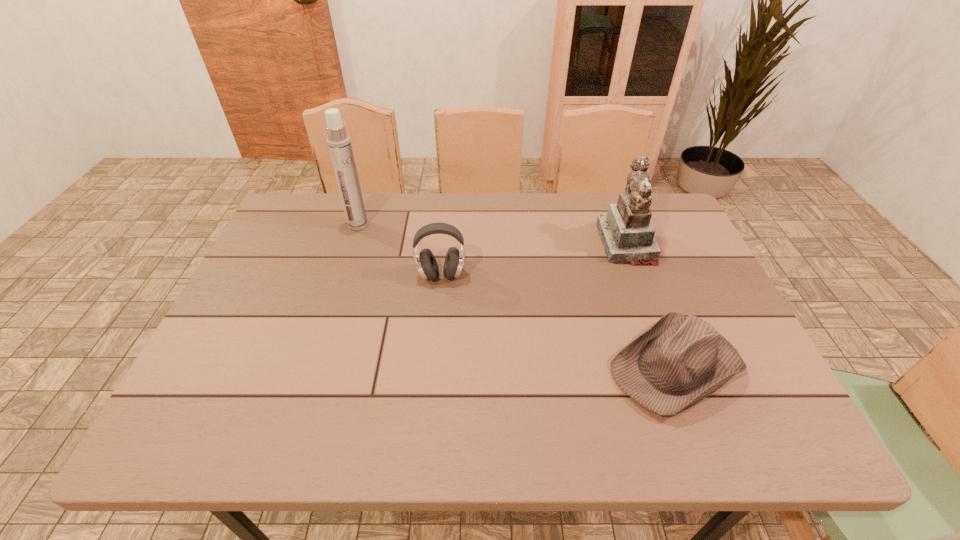
Image resolution: width=960 pixels, height=540 pixels. I want to click on free space at the far edge of the desktop, so pos(582,203).

In the image, there is a desktop. At what (x,y) coordinates should I click in order to perform the action: click on free space at the near edge. Please return your answer as a coordinate pair (x, y). The width and height of the screenshot is (960, 540). Looking at the image, I should click on (707, 435).

Locate an element on the screen. The image size is (960, 540). vacant space at the left edge is located at coordinates (248, 375).

In the image, there is a desktop. Identify the location of blank space at the right edge. (652, 287).

Find the location of a particular element. The height and width of the screenshot is (540, 960). vacant space at the far left corner is located at coordinates (304, 237).

In the image, there is a desktop. At what (x,y) coordinates should I click in order to perform the action: click on vacant space at the far right corner. Please return your answer as a coordinate pair (x, y). Looking at the image, I should click on (659, 202).

Identify the location of free point at the near right corner. (760, 413).

This screenshot has height=540, width=960. I want to click on empty space between the figurine and the tallest object, so click(492, 234).

The height and width of the screenshot is (540, 960). Find the location of `vacant space in between the headset and the figurine`. vacant space in between the headset and the figurine is located at coordinates (534, 259).

Locate an element on the screen. free space between the second tallest object and the third object from right to left is located at coordinates (534, 259).